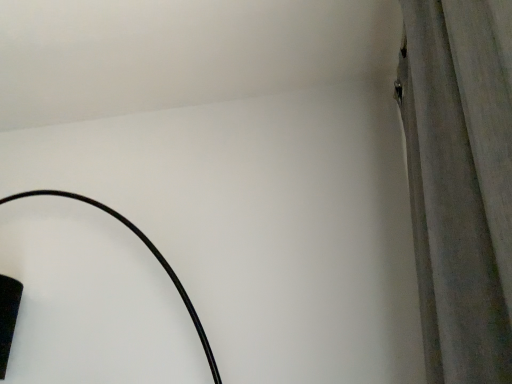
What do you see at coordinates (460, 182) in the screenshot?
I see `gray textured curtain at right` at bounding box center [460, 182].

I want to click on gray textured curtain at right, so click(x=460, y=182).

Looking at this image, measure the distance between point (409, 102) and camera.

Point (409, 102) and camera are 1.07 meters apart from each other.

The width and height of the screenshot is (512, 384). Find the location of `gray textured curtain at right`. gray textured curtain at right is located at coordinates (460, 182).